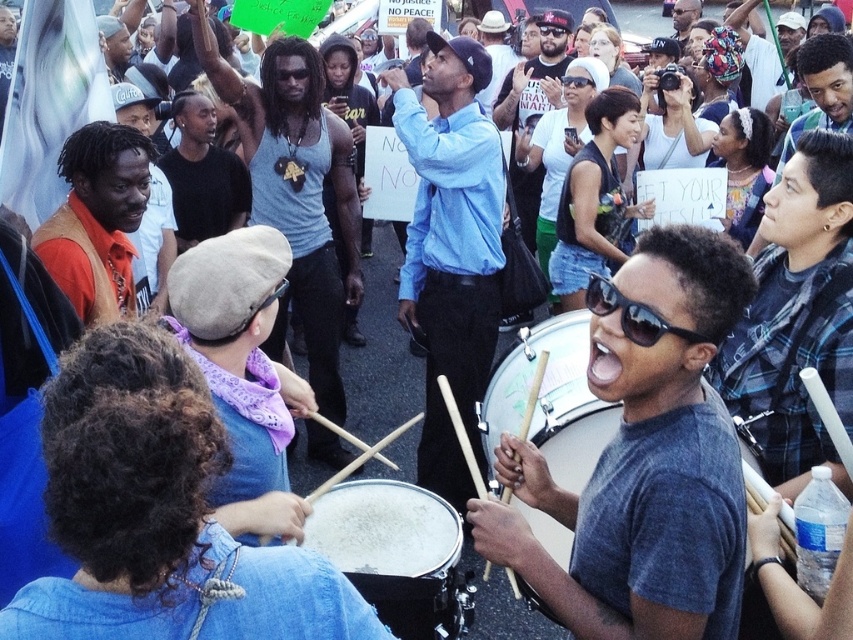
You are a photographer at the protest scene. You want to take a photo that includes both the gray matte drum at center and the blue plaid shirt at right. Based on their positions, which object should you place on the left side of your camera frame?

The gray matte drum at center should be placed on the left side of your camera frame because it is positioned to the left of the blue plaid shirt at right.

You are a photographer trying to capture the protest scene. You notice two individuals in blue clothing, the blue plaid shirt at right and the matte blue tank top at center. Which of these two is larger in size?

The matte blue tank top at center is larger than the blue plaid shirt at right.

In the protest scene, you notice the gray matte drum at center and the blue plaid shirt at right. Which object is shorter?

The gray matte drum at center is shorter than the blue plaid shirt at right.